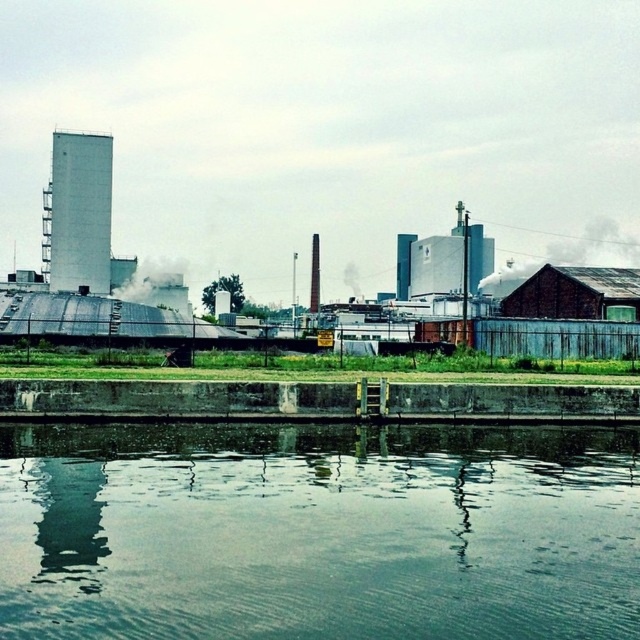
Question: Which of the following is the farthest from the observer?

Choices:
 (A) white smoke at center
 (B) white smoke at upper right

Answer: (A)

Question: Which of the following is the closest to the observer?

Choices:
 (A) (160, 288)
 (B) (630, 253)

Answer: (A)

Question: Is green reflective water at center bigger than white smoke at upper right?

Choices:
 (A) yes
 (B) no

Answer: (B)

Question: Can you confirm if white smoke at upper right is bigger than white smoke at center?

Choices:
 (A) yes
 (B) no

Answer: (A)

Question: Which point is farther to the camera?

Choices:
 (A) white smoke at upper right
 (B) green reflective water at center

Answer: (A)

Question: Is green reflective water at center wider than white smoke at center?

Choices:
 (A) yes
 (B) no

Answer: (B)